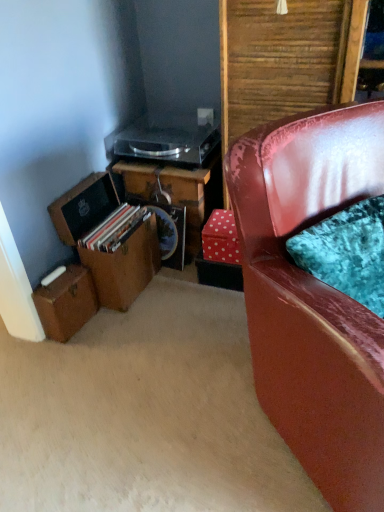
Where is `free space in front of brown leather suitcase at lower left, the second box from the bottom`? free space in front of brown leather suitcase at lower left, the second box from the bottom is located at coordinates (121, 330).